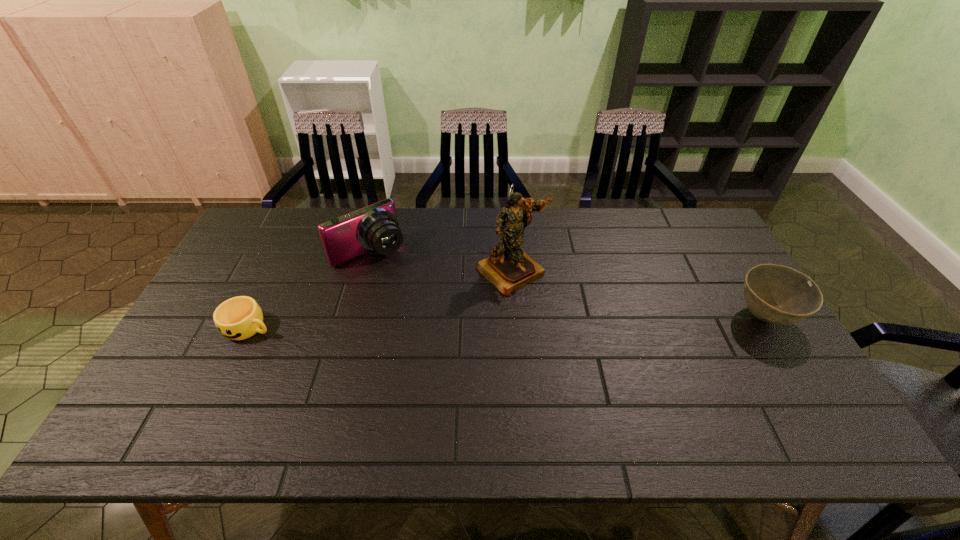
I want to click on blank space at the far edge of the desktop, so click(586, 223).

The height and width of the screenshot is (540, 960). In the image, there is a desktop. In order to click on free space at the near edge in this screenshot , I will do `click(262, 394)`.

The width and height of the screenshot is (960, 540). In the image, there is a desktop. Identify the location of vacant area at the left edge. (263, 286).

Where is `free region at the right edge of the desktop`? The image size is (960, 540). free region at the right edge of the desktop is located at coordinates (702, 259).

This screenshot has width=960, height=540. Find the location of `free region at the far right corner of the desktop`. free region at the far right corner of the desktop is located at coordinates (699, 236).

At what (x,y) coordinates should I click in order to perform the action: click on empty space between the cup and the third object from left to right. Please return your answer as a coordinate pair (x, y). The height and width of the screenshot is (540, 960). Looking at the image, I should click on (380, 299).

Locate an element on the screen. This screenshot has width=960, height=540. blank region between the leftmost object and the camera is located at coordinates (310, 289).

The height and width of the screenshot is (540, 960). I want to click on free point between the cup and the second object from right to left, so click(380, 299).

This screenshot has height=540, width=960. What are the coordinates of `free space between the shortest object and the camera` in the screenshot? It's located at (310, 289).

The height and width of the screenshot is (540, 960). Identify the location of blank region between the camera and the cup. (310, 289).